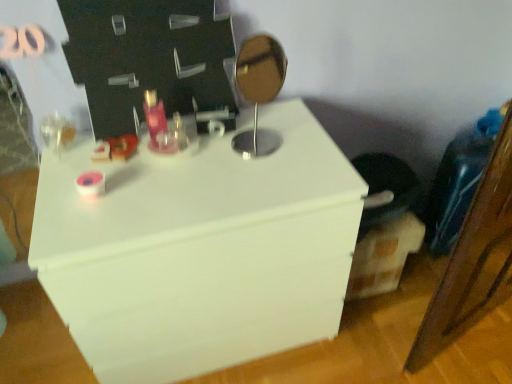
You are a GUI agent. You are given a task and a screenshot of the screen. Output one action in this format:
    pyautogui.click(x=<x>, y=<y>)
    Task: Click on the vacant space in front of matte pink glass at center
    This screenshot has height=384, width=512.
    Given the screenshot: What is the action you would take?
    pyautogui.click(x=157, y=187)